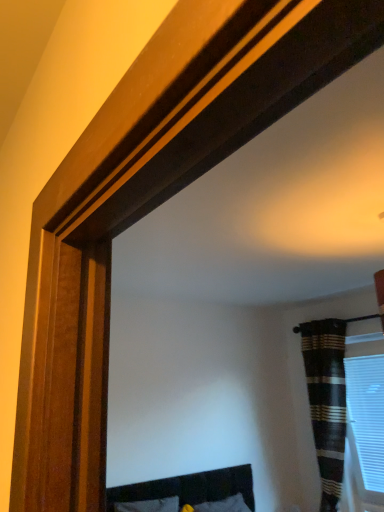
Question: Is striped fabric curtain at right in front of or behind white plastic blinds at right in the image?

Choices:
 (A) front
 (B) behind

Answer: (A)

Question: Is point (324, 478) closer or farther from the camera than point (347, 412)?

Choices:
 (A) closer
 (B) farther

Answer: (B)

Question: Is striped fabric curtain at right situated inside white plastic blinds at right or outside?

Choices:
 (A) inside
 (B) outside

Answer: (B)

Question: From the image's perspective, is white plastic blinds at right positioned above or below striped fabric curtain at right?

Choices:
 (A) below
 (B) above

Answer: (A)

Question: In the image, is white plastic blinds at right positioned in front of or behind striped fabric curtain at right?

Choices:
 (A) behind
 (B) front

Answer: (A)

Question: Considering the positions of white plastic blinds at right and striped fabric curtain at right in the image, is white plastic blinds at right taller or shorter than striped fabric curtain at right?

Choices:
 (A) short
 (B) tall

Answer: (A)

Question: Is white plastic blinds at right to the left or to the right of striped fabric curtain at right in the image?

Choices:
 (A) left
 (B) right

Answer: (B)